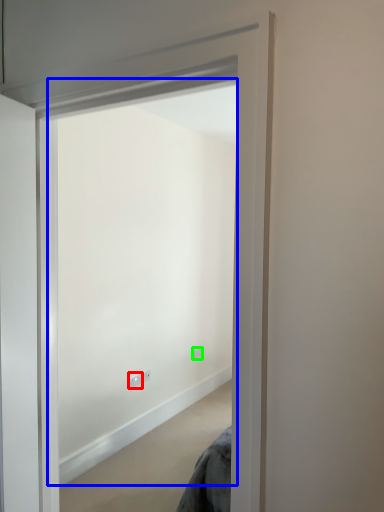
Question: Based on their relative distances, which object is farther from electric outlet (highlighted by a red box)? Choose from window (highlighted by a blue box) and electric outlet (highlighted by a green box).

Choices:
 (A) window
 (B) electric outlet

Answer: (A)